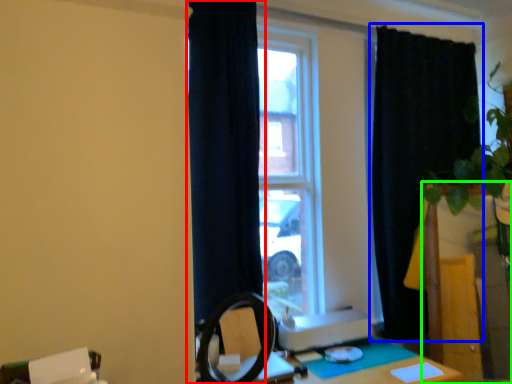
Question: Which object is positioned farthest from curtain (highlighted by a red box)? Select from curtain (highlighted by a blue box) and vanity (highlighted by a green box).

Choices:
 (A) curtain
 (B) vanity

Answer: (B)